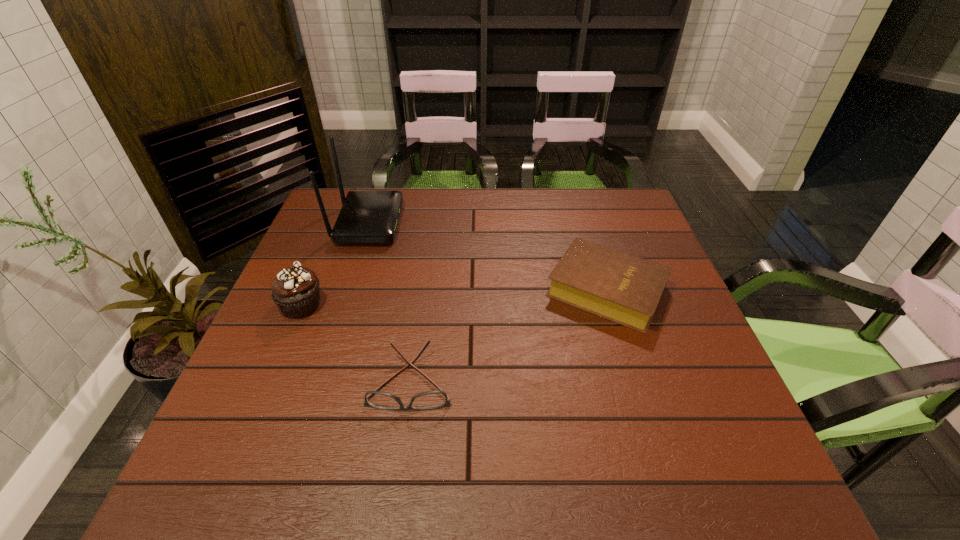
The height and width of the screenshot is (540, 960). I want to click on vacant area situated on the front-facing side of the spectacles, so click(x=399, y=468).

You are a GUI agent. You are given a task and a screenshot of the screen. Output one action in this format:
    pyautogui.click(x=<x>, y=<y>)
    Task: Click on the object positioned at the far edge
    
    Given the screenshot: What is the action you would take?
    pyautogui.click(x=367, y=217)

Identify the location of router that is at the left edge. This screenshot has width=960, height=540. (367, 217).

You are a GUI agent. You are given a task and a screenshot of the screen. Output one action in this format:
    pyautogui.click(x=<x>, y=<y>)
    Task: Click on the cupcake located at the left edge
    The height and width of the screenshot is (540, 960).
    Given the screenshot: What is the action you would take?
    [x=295, y=291]

Where is `object positioned at the right edge`? The image size is (960, 540). object positioned at the right edge is located at coordinates (625, 289).

Image resolution: width=960 pixels, height=540 pixels. In order to click on object located in the far left corner section of the desktop in this screenshot , I will do pyautogui.click(x=367, y=217).

I want to click on free location at the far edge of the desktop, so point(515,188).

Identify the location of vacant space at the near edge. (316, 477).

Image resolution: width=960 pixels, height=540 pixels. Find the location of `vacant space at the left edge of the desktop`. vacant space at the left edge of the desktop is located at coordinates (327, 293).

Identify the location of free space at the far left corner of the desktop. Image resolution: width=960 pixels, height=540 pixels. (312, 223).